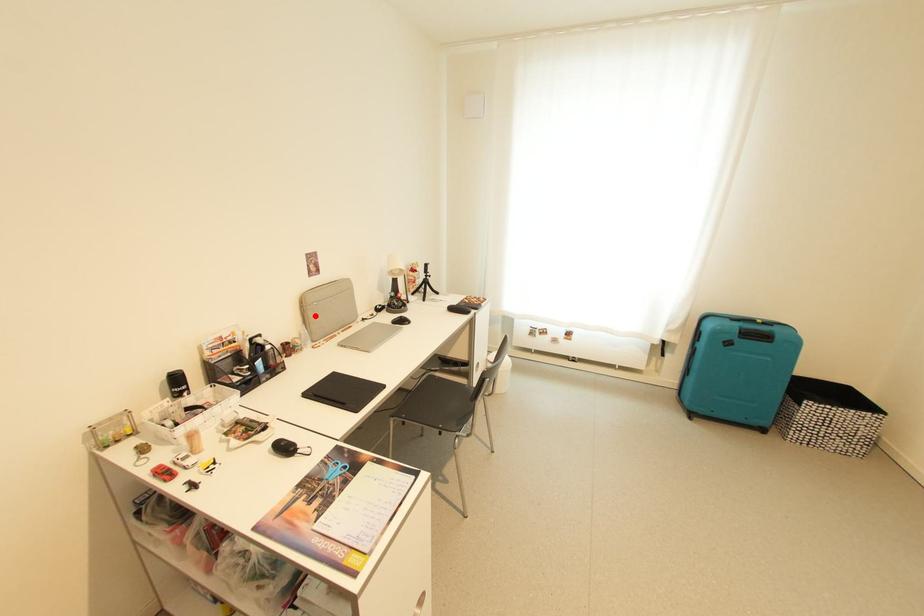
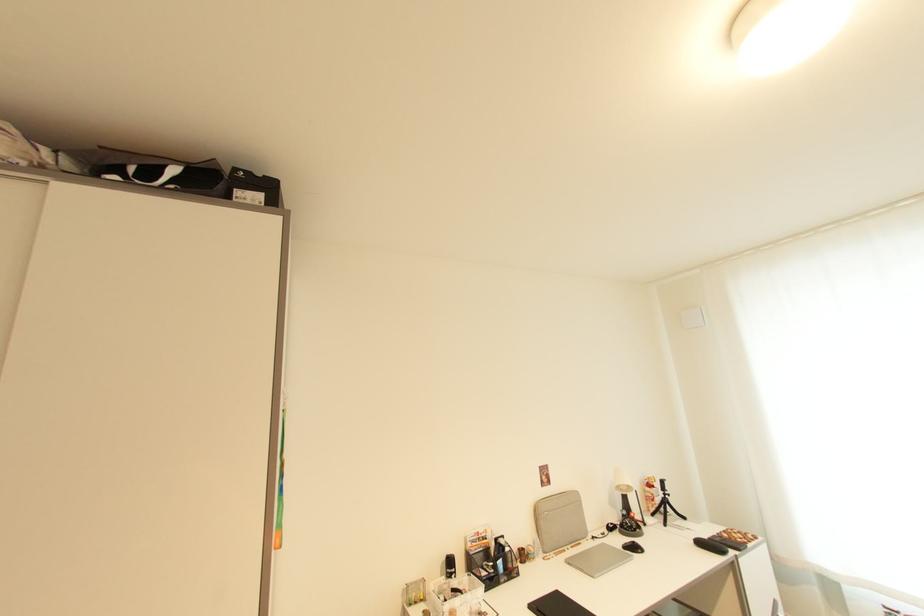
Question: I am providing you with two images of the same scene from different viewpoints. Image1 has a red point marked. In image2, the corresponding 3D location appears at what relative position? Reply with the corresponding letter.

Choices:
 (A) Closer
 (B) Farther

Answer: (B)